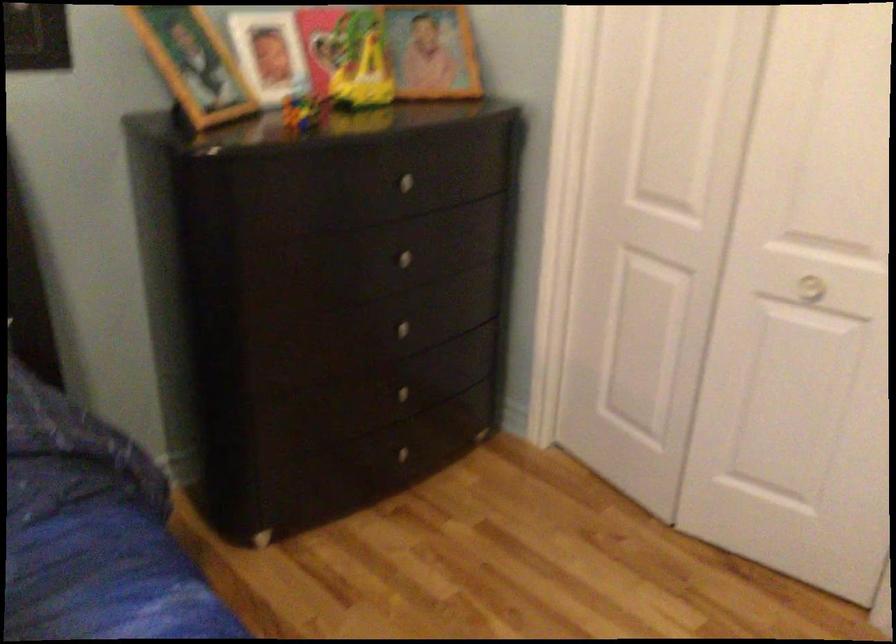
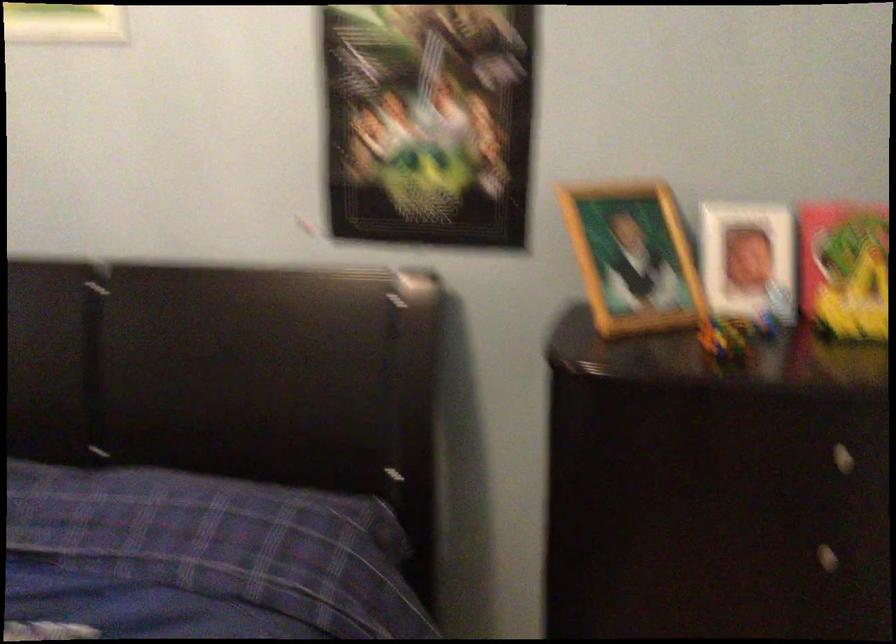
Question: Based on the continuous images, in which direction is the camera rotating? Reply with the corresponding letter.

Choices:
 (A) Left
 (B) Right
 (C) Up
 (D) Down

Answer: (A)